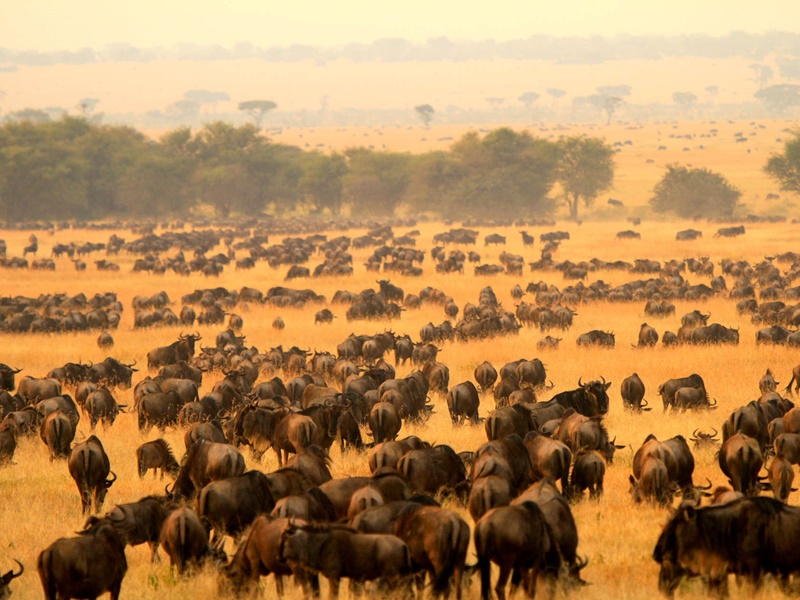
I want to click on painting, so click(614, 313).